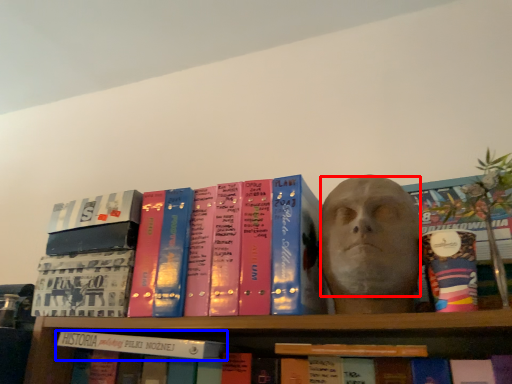
Question: Among these objects, which one is nearest to the camera, human face (highlighted by a red box) or book (highlighted by a blue box)?

Choices:
 (A) human face
 (B) book

Answer: (A)